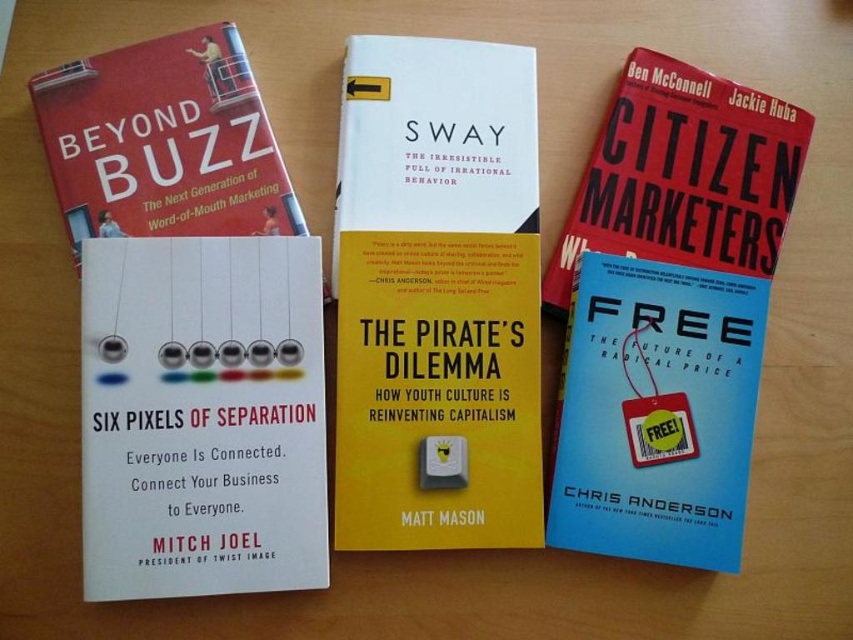
You are organizing a library shelf and need to place the yellow matte book at center and the blue matte book at center. According to their positions in the image, which book should you place first if you are arranging them from left to right?

The yellow matte book at center should be placed first since it is positioned to the left of the blue matte book at center in the image.

You are organizing a library shelf and need to place both the yellow matte book at center and the blue matte book at center. Since the shelf has limited space, which book should you place first to maximize the number of books that can fit on the shelf?

Result: The yellow matte book at center is thinner than the blue matte book at center, so placing the thinner yellow matte book at center first allows more space for additional books.